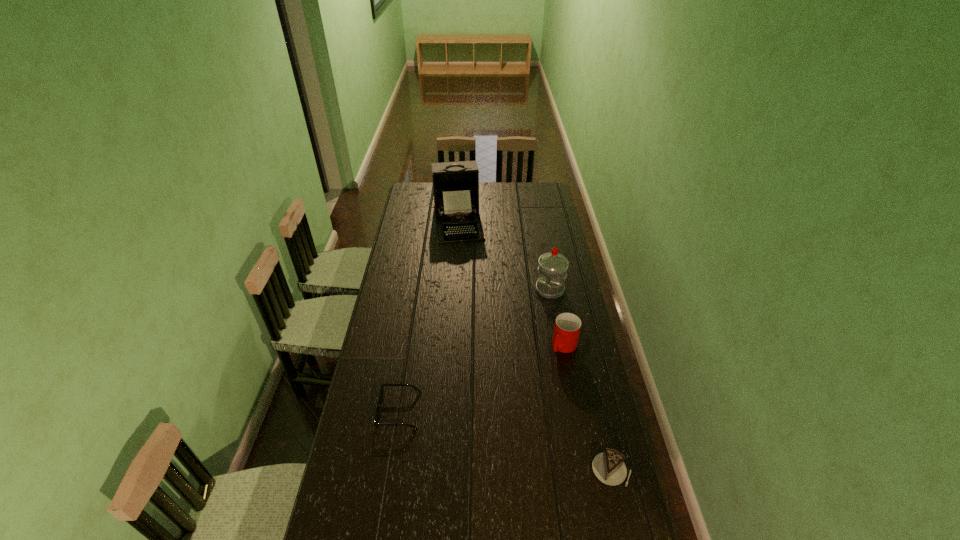
You are a GUI agent. You are given a task and a screenshot of the screen. Output one action in this format:
    pyautogui.click(x=<x>, y=<y>)
    Task: Click on the free space located on the back of the nearest object
    
    Given the screenshot: What is the action you would take?
    pyautogui.click(x=593, y=392)

The image size is (960, 540). In order to click on free space located on the side of the third tallest object with the handle in this screenshot , I will do `click(506, 415)`.

Identify the location of free spot located on the side of the third tallest object with the handle. (540, 374).

Where is `vacant space located on the side of the third tallest object with the handle`? This screenshot has height=540, width=960. vacant space located on the side of the third tallest object with the handle is located at coordinates (547, 366).

Find the location of a particular element. The width and height of the screenshot is (960, 540). vacant space situated inside the open case of the typewriter is located at coordinates (468, 291).

The height and width of the screenshot is (540, 960). What are the coordinates of `free location located inside the open case of the typewriter` in the screenshot? It's located at (464, 260).

At what (x,y) coordinates should I click in order to perform the action: click on free location located 0.200m inside the open case of the typewriter. Please return your answer as a coordinate pair (x, y). This screenshot has height=540, width=960. Looking at the image, I should click on (465, 267).

Locate an element on the screen. vacant space situated on the handle side of the water bottle is located at coordinates (536, 315).

Where is `vacant region located 0.110m on the handle side of the water bottle`? This screenshot has width=960, height=540. vacant region located 0.110m on the handle side of the water bottle is located at coordinates (537, 314).

The height and width of the screenshot is (540, 960). What are the coordinates of `vacant region located 0.150m on the handle side of the water bottle` in the screenshot? It's located at (534, 320).